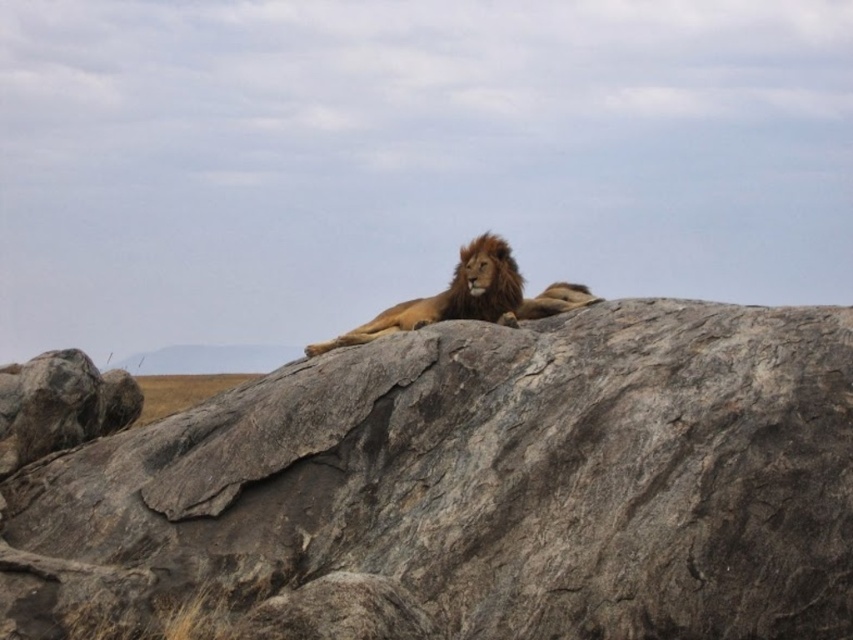
You are a photographer trying to capture the lion and the rock in the image. Since you want to ensure both subjects are visible, you need to know which one is taller. Can you tell me which is taller between the gray rough rock at center and the golden fur lion at center?

The gray rough rock at center is taller than the golden fur lion at center.

You are a photographer trying to capture the golden fur lion at center. You notice the gray rough rock at center in the background. Which object is positioned lower in the image?

The gray rough rock at center is located below the golden fur lion at center, so it is positioned lower in the image.